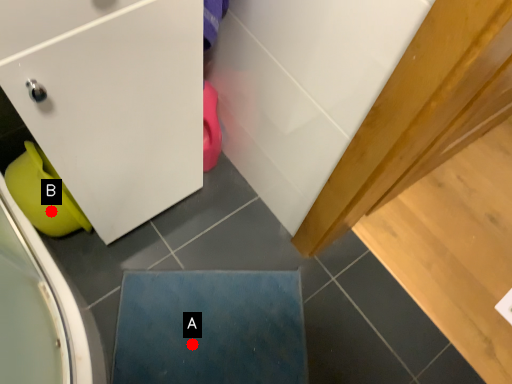
Question: Two points are circled on the image, labeled by A and B beside each circle. Which point is farther to the camera?

Choices:
 (A) A is further
 (B) B is further

Answer: (A)